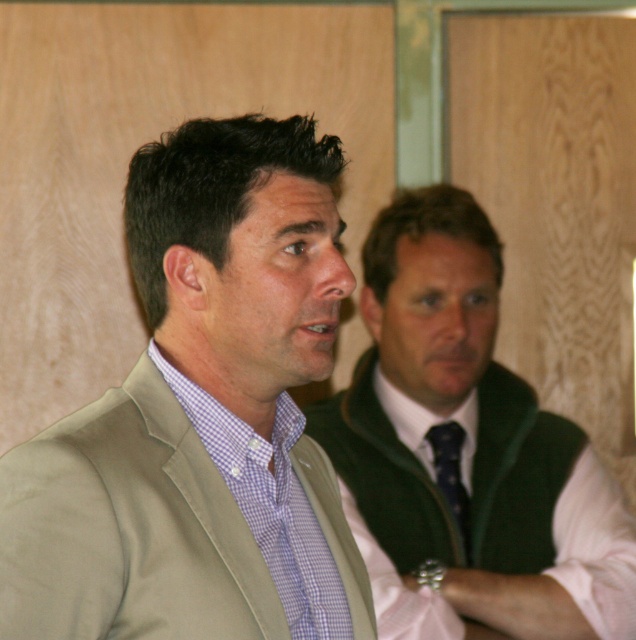
Question: Is light beige fabric jacket at center positioned before green textured vest at center?

Choices:
 (A) yes
 (B) no

Answer: (A)

Question: Can you confirm if green textured vest at center is thinner than purple checkered shirt at center?

Choices:
 (A) no
 (B) yes

Answer: (A)

Question: Among these points, which one is nearest to the camera?

Choices:
 (A) (287, 138)
 (B) (450, 451)
 (C) (307, 596)

Answer: (A)

Question: Is green textured vest at center closer to the viewer compared to dark blue silk tie at center?

Choices:
 (A) no
 (B) yes

Answer: (B)

Question: Which of the following is the farthest from the observer?

Choices:
 (A) (50, 440)
 (B) (469, 548)

Answer: (B)

Question: Which point appears farthest from the camera in this image?

Choices:
 (A) (282, 493)
 (B) (446, 486)
 (C) (163, 362)

Answer: (B)